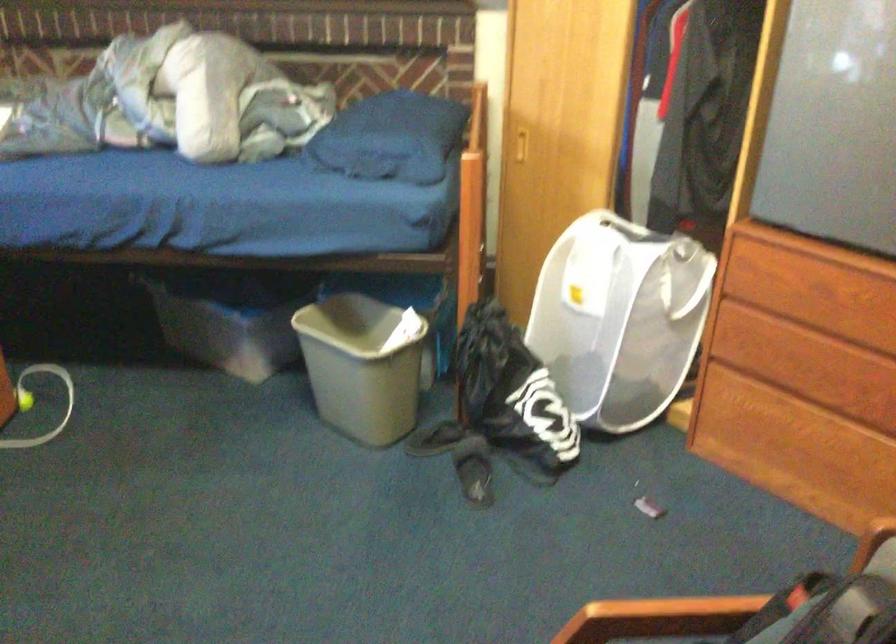
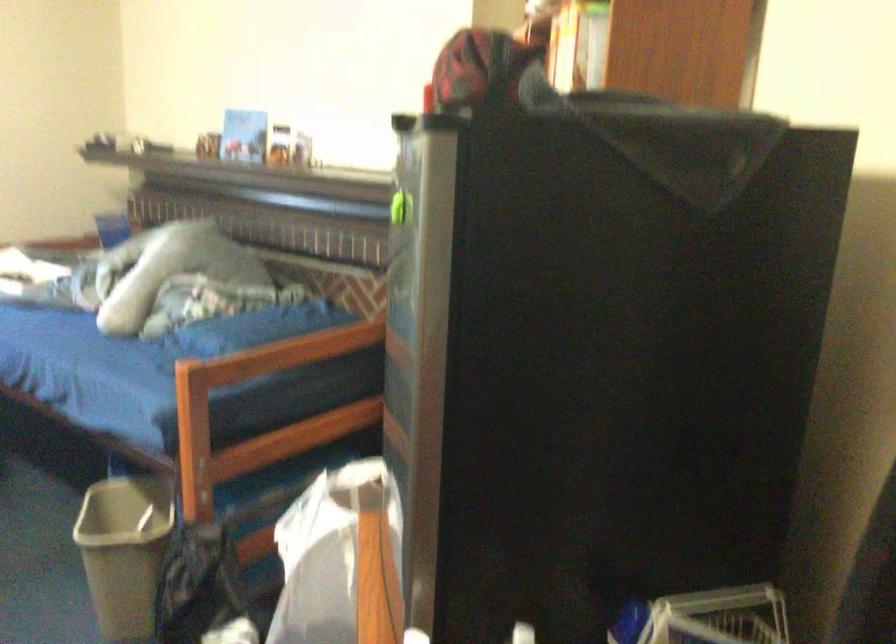
The point at (x=388, y=364) is marked in the first image. Where is the corresponding point in the second image?

(124, 552)